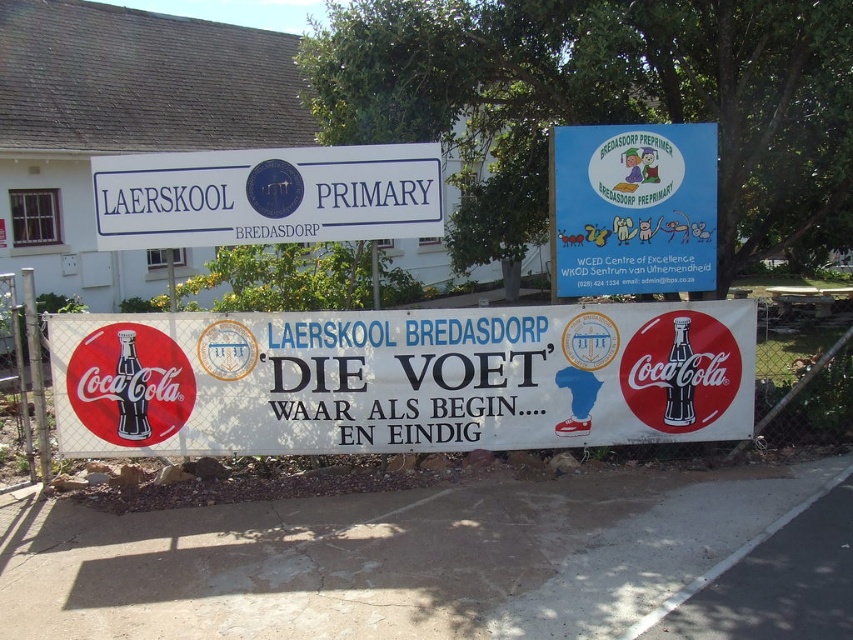
Question: Is white plastic banner at center to the right of matte black bottle at center from the viewer's perspective?

Choices:
 (A) yes
 (B) no

Answer: (A)

Question: Does white plastic banner at center appear over blue paper sign at upper right?

Choices:
 (A) yes
 (B) no

Answer: (B)

Question: Estimate the real-world distances between objects in this image. Which object is farther from the white plastic signboard at upper center?

Choices:
 (A) matte black bottle at center
 (B) blue paper sign at upper right

Answer: (B)

Question: Estimate the real-world distances between objects in this image. Which object is farther from the blue paper sign at upper right?

Choices:
 (A) matte black bottle at center
 (B) white plastic banner at center

Answer: (A)

Question: Among these objects, which one is nearest to the camera?

Choices:
 (A) white plastic signboard at upper center
 (B) matte black bottle at center
 (C) matte red coca-cola bottle at center

Answer: (A)

Question: Considering the relative positions of blue paper sign at upper right and matte red coca-cola bottle at center in the image provided, where is blue paper sign at upper right located with respect to matte red coca-cola bottle at center?

Choices:
 (A) right
 (B) left

Answer: (B)